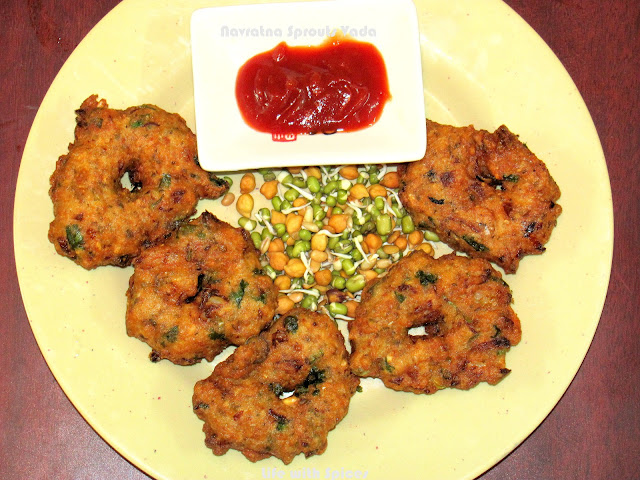
Locate an element on the screen. The height and width of the screenshot is (480, 640). plate is located at coordinates (420, 439).